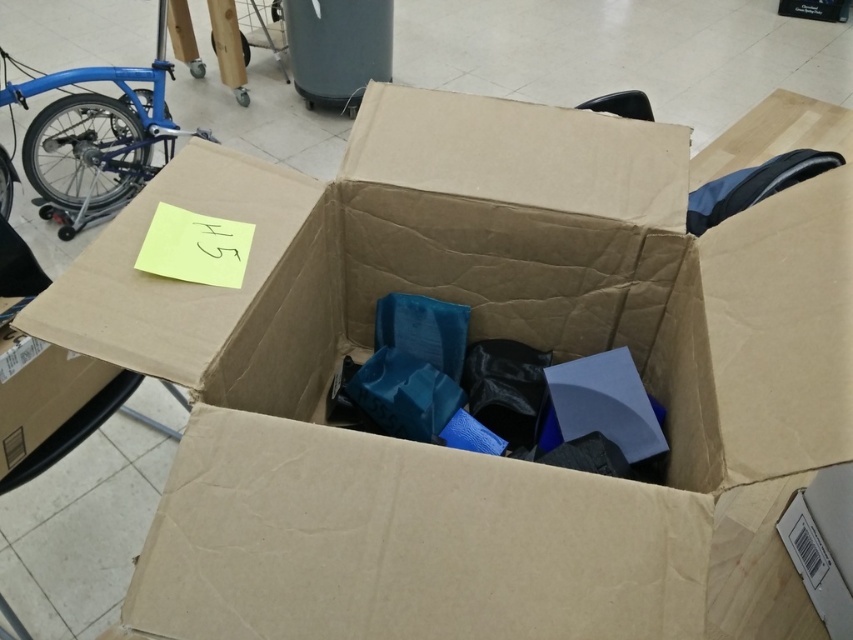
Question: Is blue matte bicycle at left bigger than cardboard box at lower left?

Choices:
 (A) yes
 (B) no

Answer: (A)

Question: Does blue matte bicycle at left appear over cardboard box at lower left?

Choices:
 (A) no
 (B) yes

Answer: (B)

Question: Does blue matte bicycle at left have a lesser width compared to cardboard box at lower left?

Choices:
 (A) no
 (B) yes

Answer: (A)

Question: Which of the following is the closest to the observer?

Choices:
 (A) (38, 449)
 (B) (125, 156)

Answer: (A)

Question: Which of the following is the closest to the observer?

Choices:
 (A) cardboard box at lower left
 (B) blue matte bicycle at left

Answer: (A)

Question: Which point appears closest to the camera in this image?

Choices:
 (A) (12, 477)
 (B) (102, 97)

Answer: (A)